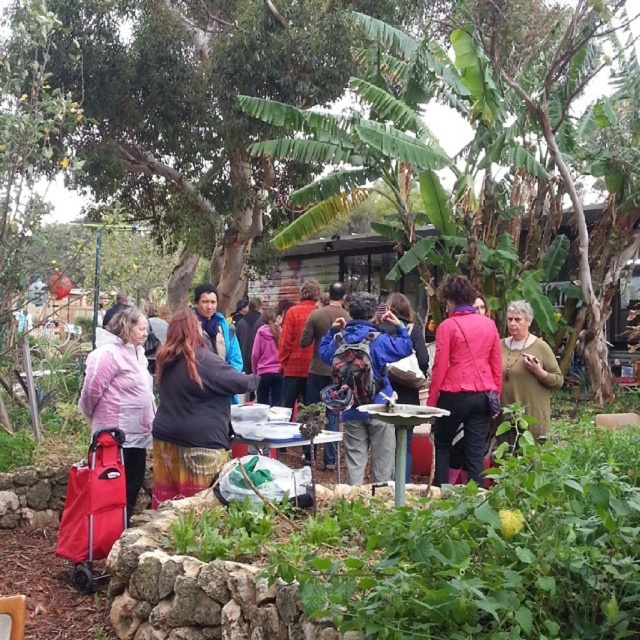
Is point (456, 417) closer to viewer compared to point (349, 417)?

Yes.

Is point (442, 454) closer to camera compared to point (376, 458)?

Yes, point (442, 454) is closer to viewer.

At what (x,y) coordinates should I click in order to perform the action: click on matte black jacket at center. Please return your answer as a coordinate pair (x, y). Looking at the image, I should click on (465, 380).

Which is behind, point (384, 396) or point (547, 406)?

The point (547, 406) is more distant.

Is blue backpack at center to the left of green textured sweater at center from the viewer's perspective?

Correct, you'll find blue backpack at center to the left of green textured sweater at center.

The width and height of the screenshot is (640, 640). What do you see at coordinates (365, 381) in the screenshot?
I see `blue backpack at center` at bounding box center [365, 381].

Identify the location of blue backpack at center. Image resolution: width=640 pixels, height=640 pixels. (365, 381).

Does matte pink jacket at center appear on the left side of matte pink jacket at left?

In fact, matte pink jacket at center is to the right of matte pink jacket at left.

From the picture: Can you confirm if matte pink jacket at center is positioned below matte pink jacket at left?

No, matte pink jacket at center is not below matte pink jacket at left.

Locate an element on the screen. The image size is (640, 640). matte pink jacket at center is located at coordinates (464, 380).

Identify the location of matte pink jacket at center. (464, 380).